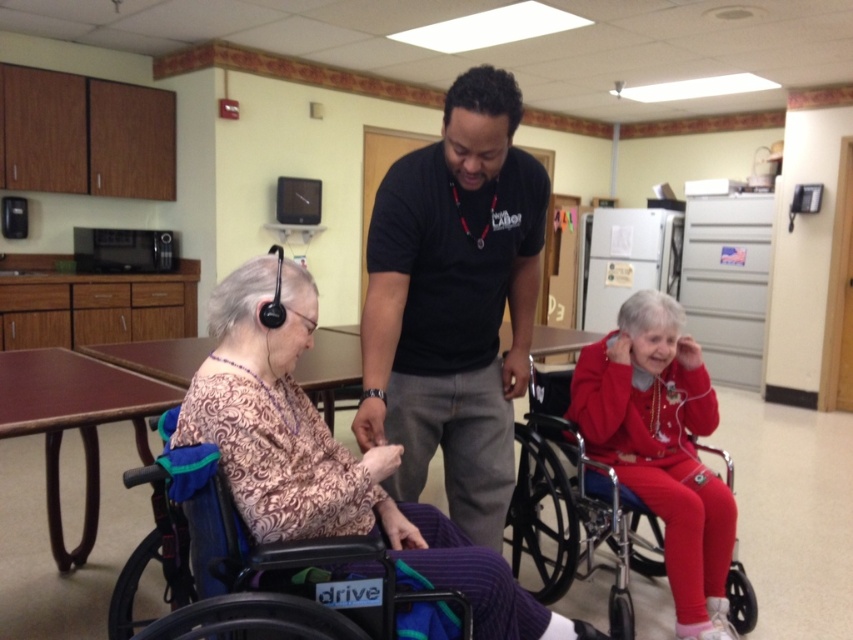
Question: Does black cotton shirt at center have a lesser width compared to metallic silver wheelchair at lower right?

Choices:
 (A) yes
 (B) no

Answer: (A)

Question: Is patterned fabric wheelchair at left bigger than metallic silver wheelchair at lower right?

Choices:
 (A) yes
 (B) no

Answer: (B)

Question: Considering the relative positions of black cotton shirt at center and patterned fabric wheelchair at left in the image provided, where is black cotton shirt at center located with respect to patterned fabric wheelchair at left?

Choices:
 (A) left
 (B) right

Answer: (B)

Question: Which object appears farthest from the camera in this image?

Choices:
 (A) patterned fabric wheelchair at left
 (B) metallic silver wheelchair at lower right

Answer: (B)

Question: Estimate the real-world distances between objects in this image. Which object is farther from the patterned fabric wheelchair at left?

Choices:
 (A) black plastic wheelchair at lower left
 (B) metallic silver wheelchair at lower right
 (C) black cotton shirt at center

Answer: (B)

Question: Estimate the real-world distances between objects in this image. Which object is closer to the metallic silver wheelchair at lower right?

Choices:
 (A) patterned fabric wheelchair at left
 (B) black plastic wheelchair at lower left
 (C) black cotton shirt at center

Answer: (C)